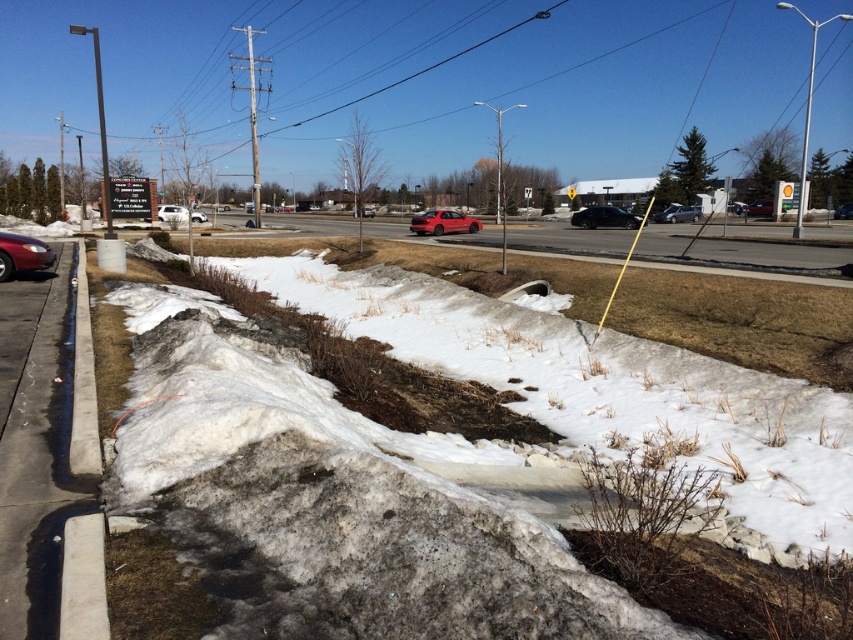
You are standing at the origin point of the image. Which object is located at the coordinates point (344, 496)?

The white powdery snow at lower center is located at point (344, 496).

You are a pedestrian standing on the sidewalk and want to cross the road to reach the park on the other side. There is a white powdery snow at lower center and a shiny black sedan at left in your path. Which object is closer to you as you prepare to step onto the road?

The shiny black sedan at left is closer to you because the white powdery snow at lower center is positioned on its right side, meaning it is further away from your current position on the sidewalk.